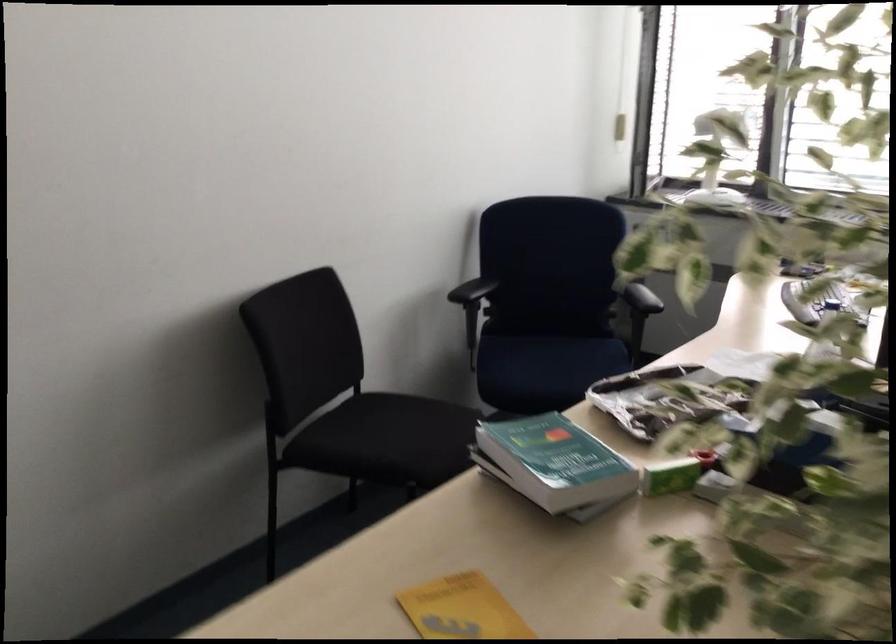
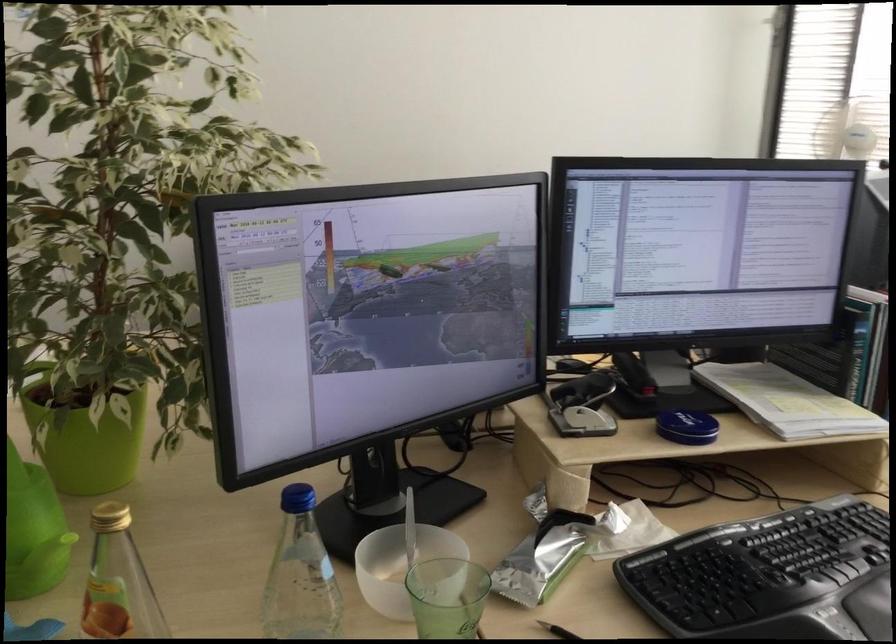
Question: I am providing you with two images of the same scene from different viewpoints. After the viewpoint changes to image2, which objects are now occluded?

Choices:
 (A) small juice bottle
 (B) black pen
 (C) white electric kettle
 (D) yellow booklet

Answer: (D)